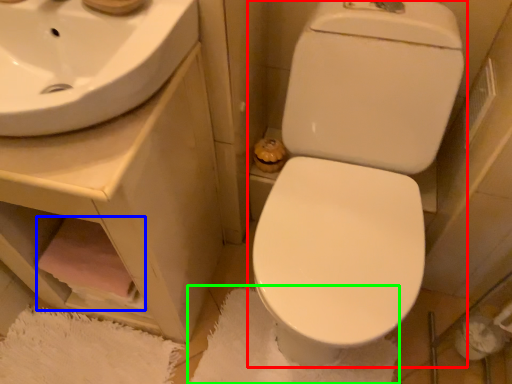
Question: Which object is positioned closest to toilet (highlighted by a red box)? Select from toilet paper (highlighted by a blue box) and bath mat (highlighted by a green box).

Choices:
 (A) toilet paper
 (B) bath mat

Answer: (B)